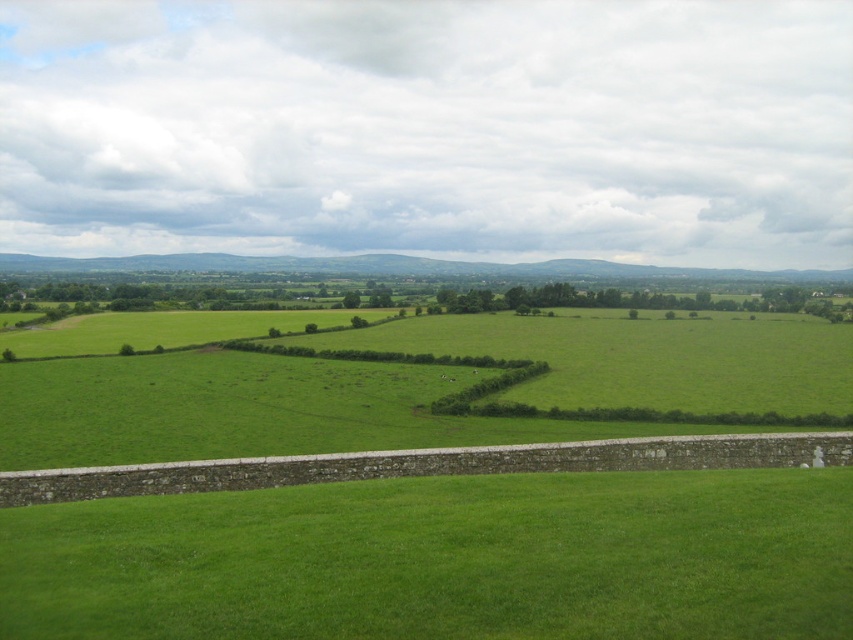
You are standing on the green grass at bottom and want to walk towards the green grass field at center. Which direction should you move to reach it?

The green grass field at center is located beyond the stone wall. Since the green grass at bottom is narrower than the green grass field at center, you should move forward towards the center of the image to reach the wider field beyond the wall.

You are standing in the middle of the green grass field at center and want to walk to the green grassy hedge at center. Which direction should you walk to get closer to the hedge?

Since the green grass field at center is closer to the viewer than the green grassy hedge at center, you should walk away from your current position towards the hedge to get closer to it.